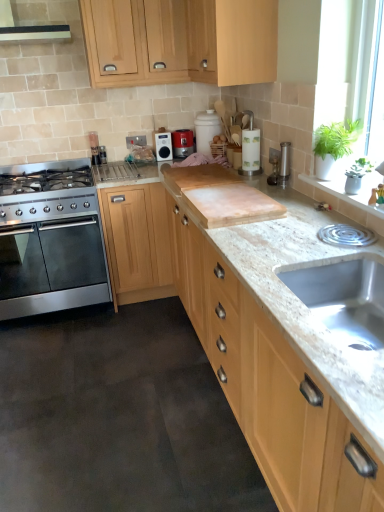
What do you see at coordinates (163, 146) in the screenshot?
I see `matte black radio at center, arranged as the first kitchen appliance when viewed from the left` at bounding box center [163, 146].

You are a GUI agent. You are given a task and a screenshot of the screen. Output one action in this format:
    pyautogui.click(x=<x>, y=<y>)
    Task: Click on the stainless steel gas stove at left
    This screenshot has height=512, width=384.
    Given the screenshot: What is the action you would take?
    pyautogui.click(x=46, y=191)

Based on the photo, in order to face metallic silver toaster at upper center, should I rotate leftwards or rightwards?

Rotate left and turn 12.489 degrees.

Image resolution: width=384 pixels, height=512 pixels. What do you see at coordinates (187, 41) in the screenshot?
I see `light wood cabinet at upper center, the third cabinetry ordered from the bottom` at bounding box center [187, 41].

I want to click on matte black radio at center, arranged as the first kitchen appliance when viewed from the left, so click(x=163, y=146).

From the image's perspective, between stainless steel gas stove at left and light wood cabinet at upper center, which is the first cabinetry from top to bottom, which one is located above?

light wood cabinet at upper center, which is the first cabinetry from top to bottom.

Based on their sizes in the image, would you say stainless steel gas stove at left is bigger or smaller than light wood cabinet at upper center, which is the first cabinetry from top to bottom?

stainless steel gas stove at left is smaller than light wood cabinet at upper center, which is the first cabinetry from top to bottom.

Who is taller, stainless steel gas stove at left or light wood cabinet at upper center, the third cabinetry ordered from the bottom?

With more height is light wood cabinet at upper center, the third cabinetry ordered from the bottom.

Considering the relative positions of stainless steel gas stove at left and light wood cabinet at upper center, the third cabinetry ordered from the bottom, in the image provided, is stainless steel gas stove at left to the right of light wood cabinet at upper center, the third cabinetry ordered from the bottom, from the viewer's perspective?

In fact, stainless steel gas stove at left is to the left of light wood cabinet at upper center, the third cabinetry ordered from the bottom.

In the scene shown: Measure the distance from green leafy plant at upper right to stainless steel oven at left.

green leafy plant at upper right and stainless steel oven at left are 5.59 feet apart from each other.

Consider the image. From the image's perspective, is green leafy plant at upper right located above or below stainless steel oven at left?

Based on their image positions, green leafy plant at upper right is located above stainless steel oven at left.

The width and height of the screenshot is (384, 512). I want to click on oven on the left of green leafy plant at upper right, so 56,271.

Does green leafy plant at upper right appear on the left side of stainless steel oven at left?

Incorrect, green leafy plant at upper right is not on the left side of stainless steel oven at left.

Where is `cabinetry that is behind the stainless steel oven at left`? cabinetry that is behind the stainless steel oven at left is located at coordinates (137, 242).

Is stainless steel oven at left smaller than light wood cabinet at center, the 1th cabinetry when ordered from bottom to top?

Actually, stainless steel oven at left might be larger than light wood cabinet at center, the 1th cabinetry when ordered from bottom to top.

Which of these two, stainless steel oven at left or light wood cabinet at center, the 1th cabinetry when ordered from bottom to top, is thinner?

light wood cabinet at center, the 1th cabinetry when ordered from bottom to top, is thinner.

Is the position of metallic silver toaster at center, which is counted as the 1th kitchen appliance, starting from the right, more distant than that of stainless steel gas stove at left?

Yes, the depth of metallic silver toaster at center, which is counted as the 1th kitchen appliance, starting from the right, is greater than that of stainless steel gas stove at left.

From a real-world perspective, which is physically above, metallic silver toaster at center, which is counted as the 1th kitchen appliance, starting from the right, or stainless steel gas stove at left?

In real-world perspective, metallic silver toaster at center, which is counted as the 1th kitchen appliance, starting from the right, is above.

Between metallic silver toaster at center, which is counted as the 1th kitchen appliance, starting from the right, and stainless steel gas stove at left, which one appears on the right side from the viewer's perspective?

metallic silver toaster at center, which is counted as the 1th kitchen appliance, starting from the right.

Is point (145, 188) more distant than point (256, 3)?

That is True.

Choose the correct answer: Is light wood cabinet at center, the 1th cabinetry when ordered from bottom to top, inside light wood cabinet at upper center, the third cabinetry ordered from the bottom, or outside it?

The correct answer is: outside.

Is light wood cabinet at upper center, which is the first cabinetry from top to bottom, at the back of light wood cabinet at center, placed as the third cabinetry when sorted from top to bottom?

No.

Locate an element on the screen. the 2nd cabinetry behind when counting from the light wood cabinet at upper center, the third cabinetry ordered from the bottom is located at coordinates (137, 242).

Is stainless steel oven at left positioned with its back to light wood cabinet at upper center, which is the second cabinetry in top-to-bottom order?

No, stainless steel oven at left is not facing away from light wood cabinet at upper center, which is the second cabinetry in top-to-bottom order.

Where is `oven that appears below the light wood cabinet at upper center, which is the second cabinetry in top-to-bottom order (from the image's perspective)`? This screenshot has height=512, width=384. oven that appears below the light wood cabinet at upper center, which is the second cabinetry in top-to-bottom order (from the image's perspective) is located at coordinates (56, 271).

Is stainless steel oven at left positioned beyond the bounds of light wood cabinet at upper center, which is the second cabinetry from bottom to top?

Yes, stainless steel oven at left is located beyond the bounds of light wood cabinet at upper center, which is the second cabinetry from bottom to top.

Considering the positions of objects metallic silver toaster at upper center and light wood cabinet at center, the 1th cabinetry when ordered from bottom to top, in the image provided, who is more to the left, metallic silver toaster at upper center or light wood cabinet at center, the 1th cabinetry when ordered from bottom to top,?

metallic silver toaster at upper center is more to the left.

Considering the points (98, 162) and (136, 231), which point is behind, point (98, 162) or point (136, 231)?

Point (98, 162)

Is metallic silver toaster at upper center not within light wood cabinet at center, the 1th cabinetry when ordered from bottom to top?

Yes, metallic silver toaster at upper center is not within light wood cabinet at center, the 1th cabinetry when ordered from bottom to top.

From the image's perspective, which is below, metallic silver toaster at upper center or light wood cabinet at center, the 1th cabinetry when ordered from bottom to top?

light wood cabinet at center, the 1th cabinetry when ordered from bottom to top, from the image's perspective.

From a real-world perspective, count 2nd cabinetrys upward from the stainless steel gas stove at left and point to it. Please provide its 2D coordinates.

[(187, 41)]

Identify the location of oven behind the green leafy plant at upper right. (56, 271).

From the picture: Estimate the real-world distances between objects in this image. Which object is further from metallic silver toaster at upper center, light wood cabinet at upper center, which is the second cabinetry in top-to-bottom order, or light wood cabinet at upper center, the third cabinetry ordered from the bottom?

The object further to metallic silver toaster at upper center is light wood cabinet at upper center, which is the second cabinetry in top-to-bottom order.

Estimate the real-world distances between objects in this image. Which object is further from light wood cabinet at center, the 1th cabinetry when ordered from bottom to top, matte black radio at center, arranged as the first kitchen appliance when viewed from the left, or stainless steel oven at left?

matte black radio at center, arranged as the first kitchen appliance when viewed from the left, is further to light wood cabinet at center, the 1th cabinetry when ordered from bottom to top.

Considering their positions, is stainless steel gas stove at left positioned further to matte black radio at center, which ranks as the second kitchen appliance in right-to-left order, than light wood cabinet at upper center, which is the second cabinetry in top-to-bottom order?

Among the two, light wood cabinet at upper center, which is the second cabinetry in top-to-bottom order, is located further to matte black radio at center, which ranks as the second kitchen appliance in right-to-left order.

From the image, which object appears to be farther from matte black radio at center, arranged as the first kitchen appliance when viewed from the left, stainless steel oven at left or light wood cabinet at upper center, which is the second cabinetry in top-to-bottom order?

stainless steel oven at left lies further to matte black radio at center, arranged as the first kitchen appliance when viewed from the left, than the other object.

When comparing their distances from metallic silver toaster at center, the second kitchen appliance when ordered from left to right, does stainless steel gas stove at left or stainless steel oven at left seem further?

stainless steel oven at left is further to metallic silver toaster at center, the second kitchen appliance when ordered from left to right.

Looking at the image, which one is located closer to metallic silver toaster at upper center, green leafy plant at upper right or stainless steel oven at left?

stainless steel oven at left lies closer to metallic silver toaster at upper center than the other object.

Looking at the image, which one is located closer to light wood cabinet at upper center, which is the second cabinetry in top-to-bottom order, light wood cabinet at upper center, which is the first cabinetry from top to bottom, or green leafy plant at upper right?

Based on the image, light wood cabinet at upper center, which is the first cabinetry from top to bottom, appears to be nearer to light wood cabinet at upper center, which is the second cabinetry in top-to-bottom order.

Looking at the image, which one is located further to stainless steel oven at left, stainless steel gas stove at left or light wood cabinet at upper center, which is the second cabinetry from bottom to top?

light wood cabinet at upper center, which is the second cabinetry from bottom to top, is further to stainless steel oven at left.

This screenshot has width=384, height=512. Identify the location of gas stove located between light wood cabinet at upper center, which is the first cabinetry from top to bottom, and matte black radio at center, arranged as the first kitchen appliance when viewed from the left, in the depth direction. (46, 191).

Where is `gas stove between metallic silver toaster at upper center and light wood cabinet at center, the 1th cabinetry when ordered from bottom to top, from top to bottom`? gas stove between metallic silver toaster at upper center and light wood cabinet at center, the 1th cabinetry when ordered from bottom to top, from top to bottom is located at coordinates (46, 191).

Where is `gas stove between light wood cabinet at upper center, which is the first cabinetry from top to bottom, and light wood cabinet at center, the 1th cabinetry when ordered from bottom to top, in the up-down direction`? The image size is (384, 512). gas stove between light wood cabinet at upper center, which is the first cabinetry from top to bottom, and light wood cabinet at center, the 1th cabinetry when ordered from bottom to top, in the up-down direction is located at coordinates (46, 191).

The image size is (384, 512). I want to click on gas stove between metallic silver toaster at upper center and stainless steel oven at left vertically, so pos(46,191).